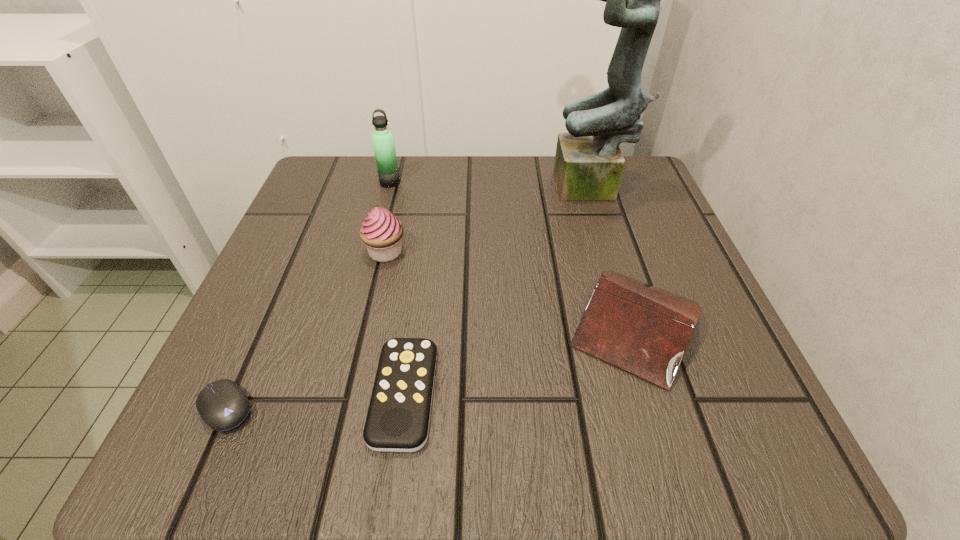
Image resolution: width=960 pixels, height=540 pixels. I want to click on vacant space that satisfies the following two spatial constraints: 1. on the back side of the leftmost object; 2. on the left side of the fifth shortest object, so click(x=326, y=182).

Locate an element on the screen. This screenshot has height=540, width=960. blank space that satisfies the following two spatial constraints: 1. on the front side of the book; 2. on the right side of the third farthest object is located at coordinates (369, 325).

Find the location of `vacant position in the image that satisfies the following two spatial constraints: 1. on the back side of the computer mouse; 2. on the left side of the book`. vacant position in the image that satisfies the following two spatial constraints: 1. on the back side of the computer mouse; 2. on the left side of the book is located at coordinates (263, 325).